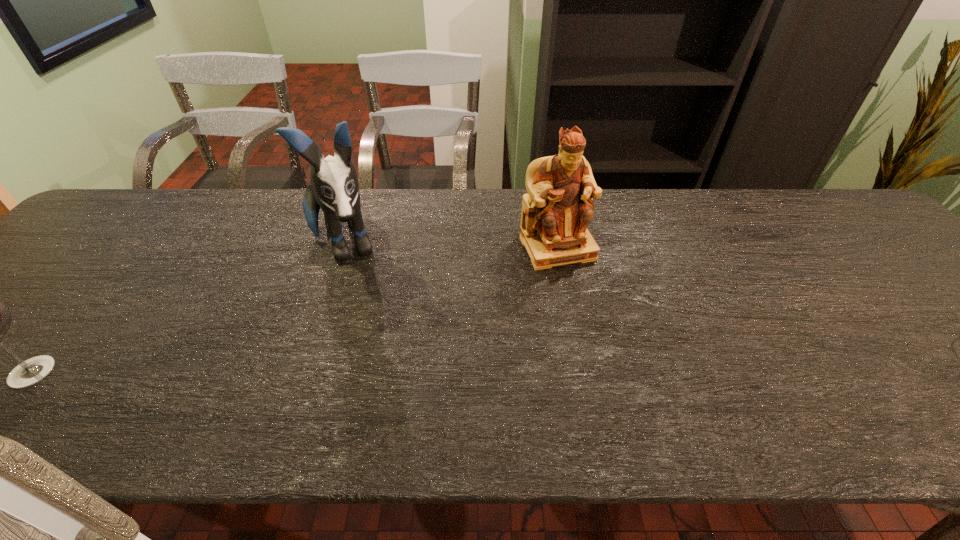
Identify the location of puppy located at the far edge. The height and width of the screenshot is (540, 960). (333, 186).

Where is `figurine positioned at the far edge`? The height and width of the screenshot is (540, 960). figurine positioned at the far edge is located at coordinates (556, 212).

This screenshot has width=960, height=540. What are the coordinates of `free region at the far edge` in the screenshot? It's located at (325, 230).

Locate an element on the screen. vacant area at the near edge is located at coordinates (564, 367).

In the image, there is a desktop. In order to click on vacant space at the left edge in this screenshot , I will do `click(90, 242)`.

Image resolution: width=960 pixels, height=540 pixels. In order to click on vacant region at the right edge of the desktop in this screenshot , I will do `click(905, 291)`.

In the image, there is a desktop. Identify the location of free space at the far left corner. (152, 207).

Find the location of a particular element. free space between the tallest object and the second shortest object is located at coordinates (450, 246).

What are the coordinates of `object that is the closest one to the second tallest object` in the screenshot? It's located at (333, 186).

Where is `object that is the closest to the wineglass`? This screenshot has width=960, height=540. object that is the closest to the wineglass is located at coordinates (333, 186).